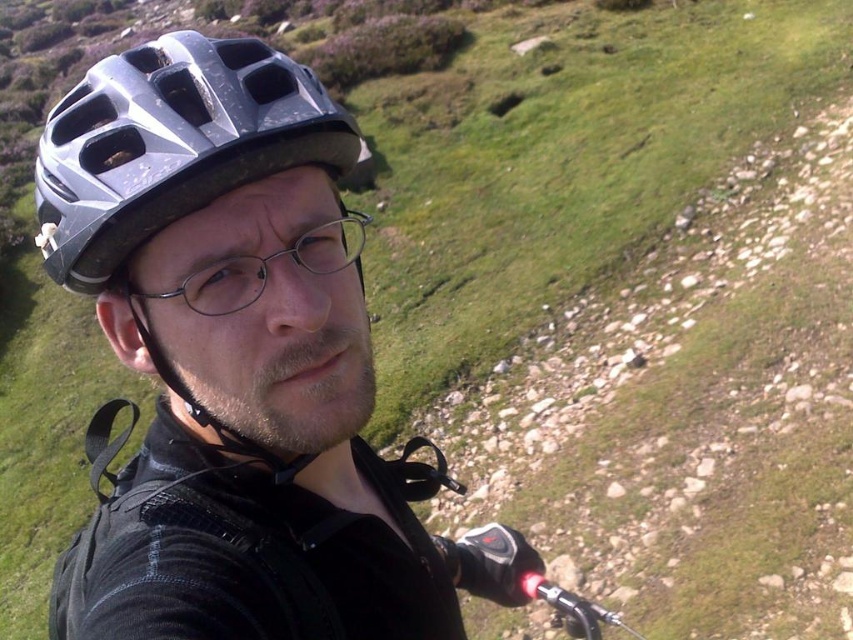
Question: Is metallic helmet at center above metallic silver helmet at upper left?

Choices:
 (A) yes
 (B) no

Answer: (B)

Question: Does metallic helmet at center appear over clear plastic glasses at center?

Choices:
 (A) no
 (B) yes

Answer: (A)

Question: Which point is farther to the camera?

Choices:
 (A) (132, 179)
 (B) (242, 189)

Answer: (B)

Question: Does metallic silver helmet at upper left appear on the right side of clear plastic glasses at center?

Choices:
 (A) no
 (B) yes

Answer: (A)

Question: Which point is closer to the camera?

Choices:
 (A) (312, 262)
 (B) (338, 604)

Answer: (A)

Question: Estimate the real-world distances between objects in this image. Which object is farther from the metallic silver helmet at upper left?

Choices:
 (A) clear plastic glasses at center
 (B) metallic helmet at center

Answer: (A)